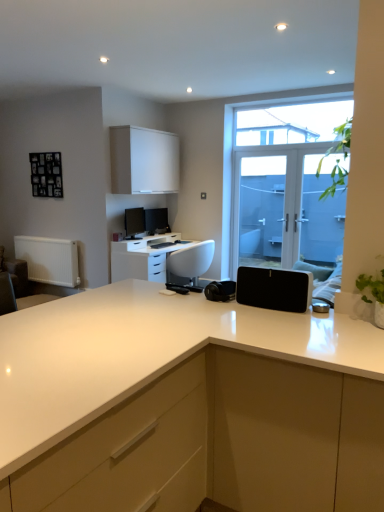
The image size is (384, 512). Find the location of `white glossy desk at center`. white glossy desk at center is located at coordinates click(x=144, y=257).

This screenshot has height=512, width=384. Describe the element at coordinates (274, 289) in the screenshot. I see `black matte speaker at center` at that location.

What do you see at coordinates (189, 406) in the screenshot?
I see `white glossy countertop at center` at bounding box center [189, 406].

The height and width of the screenshot is (512, 384). Describe the element at coordinates (236, 143) in the screenshot. I see `transparent glass door at center` at that location.

This screenshot has width=384, height=512. I want to click on white glossy desk at center, so click(x=144, y=257).

Can you confirm if white glossy desktop computer at center is thinner than matte white cabinet at center, positioned as the 2th cabinetry in back-to-front order?

In fact, white glossy desktop computer at center might be wider than matte white cabinet at center, positioned as the 2th cabinetry in back-to-front order.

Is matte white cabinet at center, which appears as the 1th cabinetry when viewed from the front, inside white glossy desktop computer at center?

Actually, matte white cabinet at center, which appears as the 1th cabinetry when viewed from the front, is outside white glossy desktop computer at center.

Is there a large distance between white glossy desktop computer at center and matte white cabinet at center, which is counted as the first cabinetry, starting from the right?

white glossy desktop computer at center is actually quite close to matte white cabinet at center, which is counted as the first cabinetry, starting from the right.

Is white matte cabinet at upper center, marked as the 2th cabinetry in a front-to-back arrangement, outside of matte black monitor at center, acting as the second computer monitor starting from the front?

white matte cabinet at upper center, marked as the 2th cabinetry in a front-to-back arrangement, lies outside matte black monitor at center, acting as the second computer monitor starting from the front,'s area.

Does white matte cabinet at upper center, marked as the 2th cabinetry in a front-to-back arrangement, have a lesser height compared to matte black monitor at center, acting as the second computer monitor starting from the front?

In fact, white matte cabinet at upper center, marked as the 2th cabinetry in a front-to-back arrangement, may be taller than matte black monitor at center, acting as the second computer monitor starting from the front.

Considering the relative positions of white matte cabinet at upper center, which is the second cabinetry from bottom to top, and matte black monitor at center, acting as the second computer monitor starting from the front, in the image provided, is white matte cabinet at upper center, which is the second cabinetry from bottom to top, to the right of matte black monitor at center, acting as the second computer monitor starting from the front, from the viewer's perspective?

In fact, white matte cabinet at upper center, which is the second cabinetry from bottom to top, is to the left of matte black monitor at center, acting as the second computer monitor starting from the front.

What's the angular difference between white matte cabinet at upper center, acting as the 2th cabinetry starting from the right, and matte black monitor at center, the 1th computer monitor in the back-to-front sequence,'s facing directions?

9.85 degrees separate the facing orientations of white matte cabinet at upper center, acting as the 2th cabinetry starting from the right, and matte black monitor at center, the 1th computer monitor in the back-to-front sequence.

Between transparent glass door at center and white glossy desktop computer at center, which one has smaller width?

transparent glass door at center.

Which point is more distant from viewer, (234,133) or (189,276)?

The point (234,133) is farther from the camera.

From the image's perspective, which one is positioned lower, transparent glass door at center or white glossy desktop computer at center?

white glossy desktop computer at center, from the image's perspective.

Image resolution: width=384 pixels, height=512 pixels. I want to click on countertop below the white glossy desk at center (from the image's perspective), so click(x=189, y=406).

Is white glossy desk at center inside or outside of white glossy countertop at center?

white glossy desk at center cannot be found inside white glossy countertop at center.

Who is taller, white glossy desk at center or white glossy countertop at center?

white glossy countertop at center.

Is white glossy desk at center wider or thinner than transparent glass door at center?

Clearly, white glossy desk at center has more width compared to transparent glass door at center.

Is white glossy desk at center oriented towards transparent glass door at center?

Yes, white glossy desk at center faces towards transparent glass door at center.

Is white glossy desk at center next to transparent glass door at center?

No, white glossy desk at center is not touching transparent glass door at center.

From the image's perspective, which object appears higher, white glossy desk at center or transparent glass door at center?

transparent glass door at center is shown above in the image.

Considering the sizes of objects matte white cabinet at center, positioned as the 2th cabinetry in top-to-bottom order, and matte black monitor at center, which appears as the first computer monitor when viewed from the front, in the image provided, who is taller, matte white cabinet at center, positioned as the 2th cabinetry in top-to-bottom order, or matte black monitor at center, which appears as the first computer monitor when viewed from the front,?

matte white cabinet at center, positioned as the 2th cabinetry in top-to-bottom order, is taller.

Consider the image. Which object is further away from the camera, matte white cabinet at center, acting as the first cabinetry starting from the bottom, or matte black monitor at center, which appears as the first computer monitor when viewed from the front?

matte black monitor at center, which appears as the first computer monitor when viewed from the front, is further from the camera.

This screenshot has width=384, height=512. In order to click on cabinetry that is under the matte black monitor at center, which is the 2th computer monitor in back-to-front order (from a real-world perspective) in this screenshot , I will do `click(274, 433)`.

Between matte white cabinet at center, positioned as the 2th cabinetry in top-to-bottom order, and matte black monitor at center, which appears as the first computer monitor when viewed from the front, which one appears on the left side from the viewer's perspective?

matte black monitor at center, which appears as the first computer monitor when viewed from the front, is more to the left.

Is black matte speaker at center looking in the opposite direction of matte black monitor at center, the 1th computer monitor in the back-to-front sequence?

black matte speaker at center does not have its back to matte black monitor at center, the 1th computer monitor in the back-to-front sequence.

Is black matte speaker at center not close to matte black monitor at center, the 1th computer monitor in the back-to-front sequence?

black matte speaker at center is positioned a significant distance from matte black monitor at center, the 1th computer monitor in the back-to-front sequence.

Can you tell me how much black matte speaker at center and matte black monitor at center, acting as the second computer monitor starting from the front, differ in facing direction?

There is a 76.5-degree angle between the facing directions of black matte speaker at center and matte black monitor at center, acting as the second computer monitor starting from the front.

Where is `desktop computer behind the matte white cabinet at center, which is the second cabinetry in left-to-right order`? Image resolution: width=384 pixels, height=512 pixels. desktop computer behind the matte white cabinet at center, which is the second cabinetry in left-to-right order is located at coordinates (189, 264).

The width and height of the screenshot is (384, 512). In order to click on computer monitor that is the 1st one when counting downward from the white matte cabinet at upper center, acting as the 2th cabinetry starting from the right (from the image's perspective) in this screenshot , I will do `click(157, 221)`.

Based on the photo, estimate the real-world distances between objects in this image. Which object is closer to matte black monitor at center, the 1th computer monitor in the back-to-front sequence, matte white cabinet at center, which is the second cabinetry in left-to-right order, or transparent glass door at center?

Among the two, transparent glass door at center is located nearer to matte black monitor at center, the 1th computer monitor in the back-to-front sequence.

Which object lies further to the anchor point transparent glass door at center, white matte cabinet at upper center, acting as the 2th cabinetry starting from the right, or white glossy countertop at center?

The object further to transparent glass door at center is white glossy countertop at center.

When comparing their distances from black matte speaker at center, does white glossy desk at center or matte black monitor at center, which appears as the first computer monitor when viewed from the front, seem further?

matte black monitor at center, which appears as the first computer monitor when viewed from the front.

Estimate the real-world distances between objects in this image. Which object is closer to white glossy countertop at center, white glossy desktop computer at center or white matte cabinet at upper center, which is the second cabinetry from bottom to top?

Based on the image, white glossy desktop computer at center appears to be nearer to white glossy countertop at center.

From the image, which object appears to be nearer to matte black monitor at center, the 1th computer monitor in the back-to-front sequence, white matte cabinet at upper center, which appears as the first cabinetry when viewed from the top, or white glossy desktop computer at center?

Among the two, white matte cabinet at upper center, which appears as the first cabinetry when viewed from the top, is located nearer to matte black monitor at center, the 1th computer monitor in the back-to-front sequence.

Which object lies further to the anchor point white matte cabinet at upper center, marked as the 2th cabinetry in a front-to-back arrangement, white glossy countertop at center or matte black monitor at center, the 1th computer monitor in the back-to-front sequence?

Among the two, white glossy countertop at center is located further to white matte cabinet at upper center, marked as the 2th cabinetry in a front-to-back arrangement.

From the picture: Considering their positions, is white glossy countertop at center positioned closer to matte black monitor at center, the 1th computer monitor in the back-to-front sequence, than transparent glass door at center?

The object closer to matte black monitor at center, the 1th computer monitor in the back-to-front sequence, is transparent glass door at center.

Considering their positions, is white glossy desktop computer at center positioned closer to matte white cabinet at center, positioned as the 2th cabinetry in top-to-bottom order, than black matte speaker at center?

black matte speaker at center is closer to matte white cabinet at center, positioned as the 2th cabinetry in top-to-bottom order.

You are a GUI agent. You are given a task and a screenshot of the screen. Output one action in this format:
    pyautogui.click(x=<x>, y=<y>)
    Task: Click on the desk between white glossy countertop at center and white glossy desktop computer at center in the front-back direction
    
    Given the screenshot: What is the action you would take?
    pyautogui.click(x=144, y=257)

You are a GUI agent. You are given a task and a screenshot of the screen. Output one action in this format:
    pyautogui.click(x=<x>, y=<y>)
    Task: Click on the desk between white glossy countertop at center and transparent glass door at center from front to back
    Image resolution: width=384 pixels, height=512 pixels.
    Given the screenshot: What is the action you would take?
    pyautogui.click(x=144, y=257)

Locate an element on the screen. appliance between white glossy countertop at center and white matte cabinet at upper center, the 1th cabinetry from the left, from front to back is located at coordinates (274, 289).

Locate an element on the screen. The image size is (384, 512). desktop computer positioned between black matte speaker at center and matte black monitor at center, which appears as the first computer monitor when viewed from the front, from near to far is located at coordinates (189, 264).